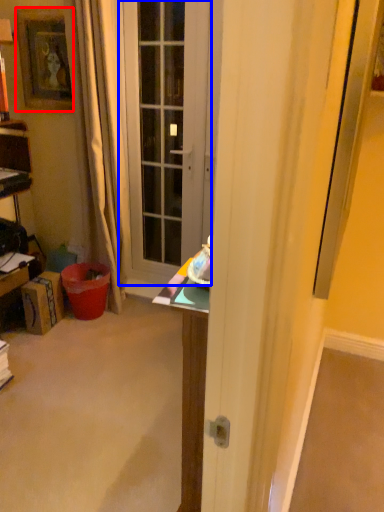
Question: Which object appears closest to the camera in this image, picture frame (highlighted by a red box) or door (highlighted by a blue box)?

Choices:
 (A) picture frame
 (B) door

Answer: (B)